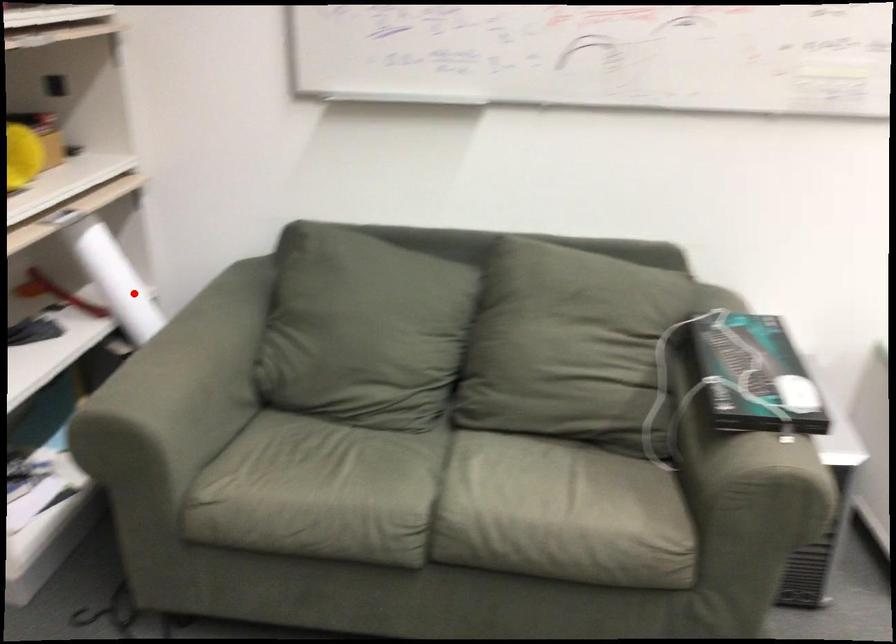
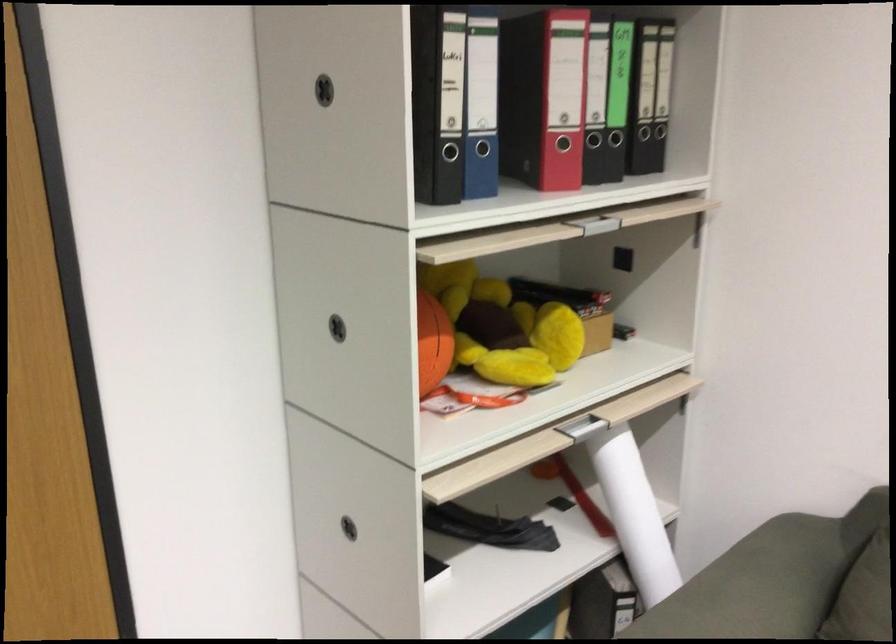
Question: I am providing you with two images of the same scene from different viewpoints. Given a red point in image1, look at the same physical point in image2. Is it:

Choices:
 (A) Closer to the viewpoint
 (B) Farther from the viewpoint

Answer: (A)